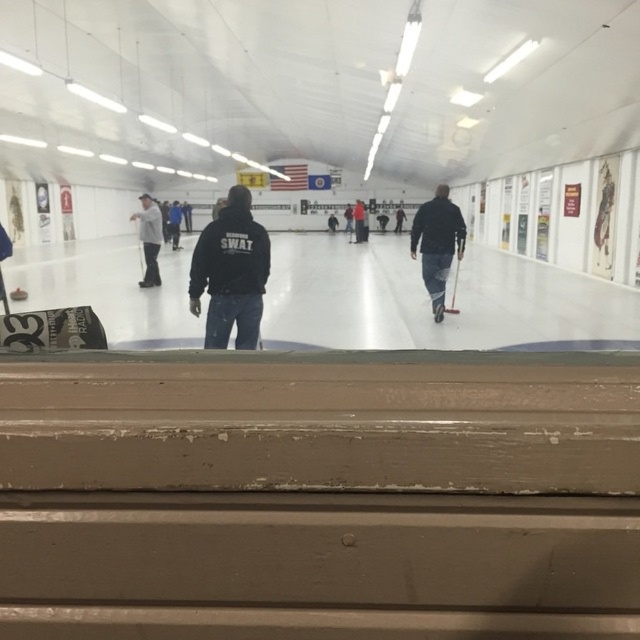
You are designing a mannequin stand for the black matte jacket at center and dark blue jeans at center. Since you need to know which garment requires a wider base, which one should you allocate more space to?

A: The dark blue jeans at center requires a wider base because its width is greater than the black matte jacket at center.

You are standing behind the wooden railing and see two people wearing jackets at the center of the ice rink. Which jacket is closer to you, the black matte jacket at center or the dark blue jacket at center?

The black matte jacket at center is closer to you because it is in front of the dark blue jacket at center.